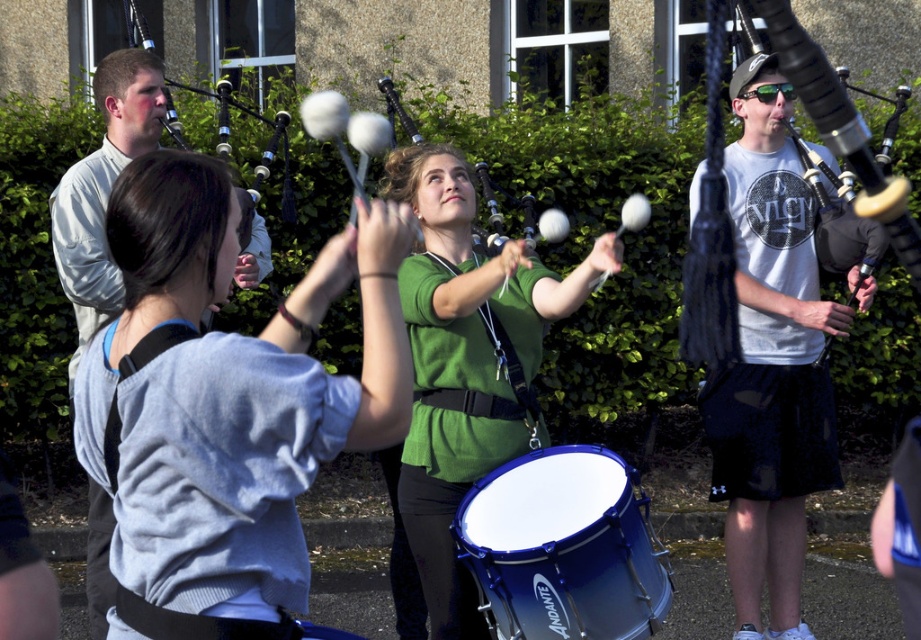
Who is positioned more to the right, green matte shirt at center or blue metallic drum at center?

From the viewer's perspective, blue metallic drum at center appears more on the right side.

The height and width of the screenshot is (640, 921). What do you see at coordinates (468, 364) in the screenshot?
I see `green matte shirt at center` at bounding box center [468, 364].

The image size is (921, 640). I want to click on green matte shirt at center, so click(x=468, y=364).

Is light blue sweater at center further to camera compared to matte black bagpipes at right?

Yes.

Between point (274, 506) and point (791, 56), which one is positioned behind?

Point (274, 506)

At what (x,y) coordinates should I click in order to perform the action: click on light blue sweater at center. Please return your answer as a coordinate pair (x, y). Looking at the image, I should click on (231, 394).

Where is `light blue sweater at center`? Image resolution: width=921 pixels, height=640 pixels. light blue sweater at center is located at coordinates (231, 394).

Is blue metallic drum at center to the left of light gray shirt at left from the viewer's perspective?

No, blue metallic drum at center is not to the left of light gray shirt at left.

Does point (596, 595) lie in front of point (105, 580)?

That is True.

Where is `blue metallic drum at center`? This screenshot has width=921, height=640. blue metallic drum at center is located at coordinates (564, 547).